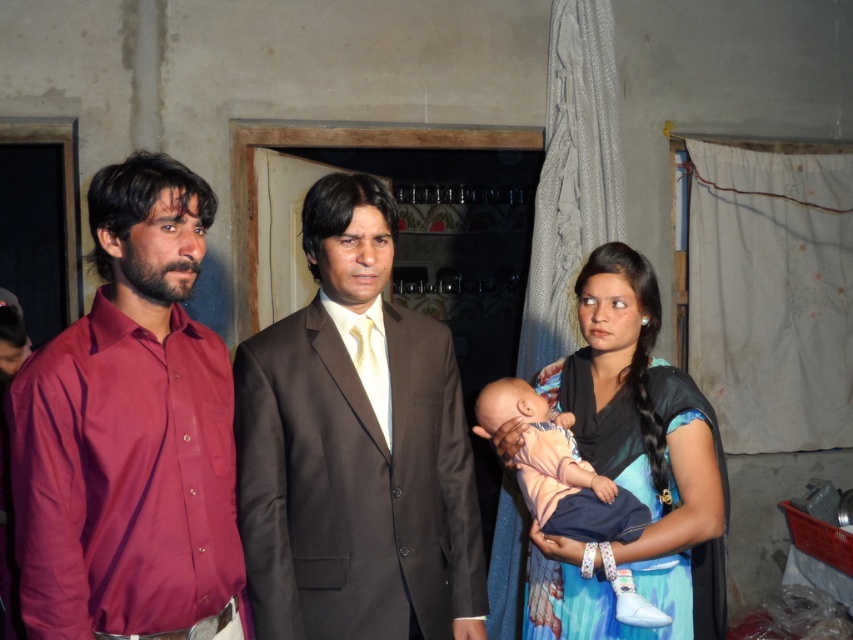
You are standing in the room and want to place a small plant between the two points labeled as point (648, 458) and point (550, 481). Since the plant needs to be placed in front of the point that is further back, which point should the plant be placed in front of?

The plant should be placed in front of point (648, 458) because it is behind point (550, 481), making it the further back point.

You are standing in the room and want to hand a document to the person wearing the matte black suit at center without disturbing the brown suit at center. Which individual should you approach first?

You should approach the matte black suit at center first because it is closer to you than the brown suit at center.